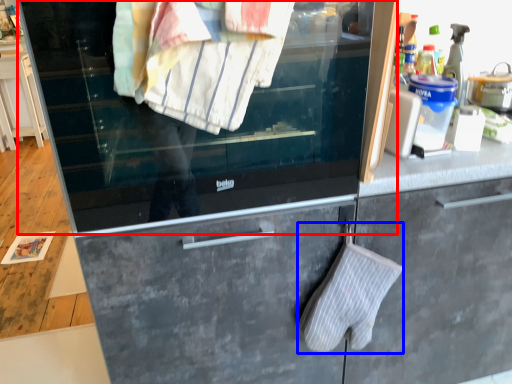
Question: Which of the following is the farthest to the observer, window (highlighted by a red box) or bath towel (highlighted by a blue box)?

Choices:
 (A) window
 (B) bath towel

Answer: (B)